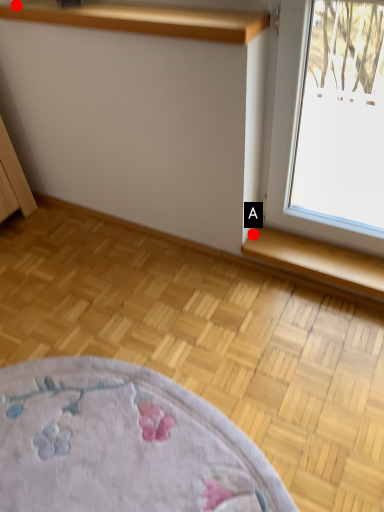
Question: Two points are circled on the image, labeled by A and B beside each circle. Which point appears farthest from the camera in this image?

Choices:
 (A) A is further
 (B) B is further

Answer: (A)